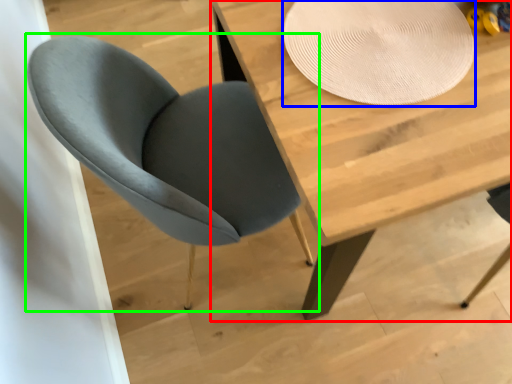
Question: Which object is positioned farthest from table (highlighted by a red box)? Select from paper plate (highlighted by a blue box) and chair (highlighted by a green box).

Choices:
 (A) paper plate
 (B) chair

Answer: (B)